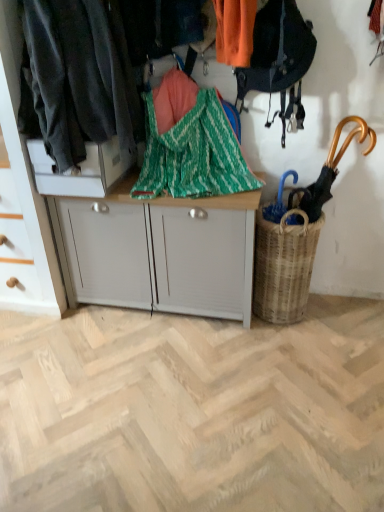
Question: From a real-world perspective, is woven brown basket at lower right located higher than wooden umbrella at right?

Choices:
 (A) no
 (B) yes

Answer: (A)

Question: Is wooden umbrella at right at the back of woven brown basket at lower right?

Choices:
 (A) yes
 (B) no

Answer: (B)

Question: From a real-world perspective, is woven brown basket at lower right below wooden umbrella at right?

Choices:
 (A) yes
 (B) no

Answer: (A)

Question: Can you confirm if woven brown basket at lower right is bigger than wooden umbrella at right?

Choices:
 (A) yes
 (B) no

Answer: (A)

Question: Does woven brown basket at lower right have a greater height compared to wooden umbrella at right?

Choices:
 (A) no
 (B) yes

Answer: (B)

Question: Is point (36, 283) closer or farther from the camera than point (94, 2)?

Choices:
 (A) closer
 (B) farther

Answer: (B)

Question: Based on their positions, is white matte cabinet at left, which is counted as the second cabinetry, starting from the right, located to the left or right of dark gray fabric at left?

Choices:
 (A) right
 (B) left

Answer: (B)

Question: From a real-world perspective, relative to dark gray fabric at left, is white matte cabinet at left, which is counted as the second cabinetry, starting from the right, vertically above or below?

Choices:
 (A) above
 (B) below

Answer: (B)

Question: From the image's perspective, is white matte cabinet at left, which is counted as the second cabinetry, starting from the right, above or below dark gray fabric at left?

Choices:
 (A) below
 (B) above

Answer: (A)

Question: Choose the correct answer: Is woven brown basket at lower right inside white matte cabinet at left, which is the first cabinetry from left to right, or outside it?

Choices:
 (A) outside
 (B) inside

Answer: (A)

Question: From a real-world perspective, relative to white matte cabinet at left, which is the first cabinetry from left to right, is woven brown basket at lower right vertically above or below?

Choices:
 (A) above
 (B) below

Answer: (B)

Question: In terms of width, does woven brown basket at lower right look wider or thinner when compared to white matte cabinet at left, which is counted as the second cabinetry, starting from the right?

Choices:
 (A) thin
 (B) wide

Answer: (A)

Question: Based on their sizes in the image, would you say woven brown basket at lower right is bigger or smaller than white matte cabinet at left, which is counted as the second cabinetry, starting from the right?

Choices:
 (A) small
 (B) big

Answer: (A)

Question: Is white matte cabinet at left, which is the first cabinetry from left to right, taller or shorter than green zigzag fabric at center?

Choices:
 (A) short
 (B) tall

Answer: (B)

Question: Does point (26, 178) appear closer or farther from the camera than point (248, 169)?

Choices:
 (A) closer
 (B) farther

Answer: (A)